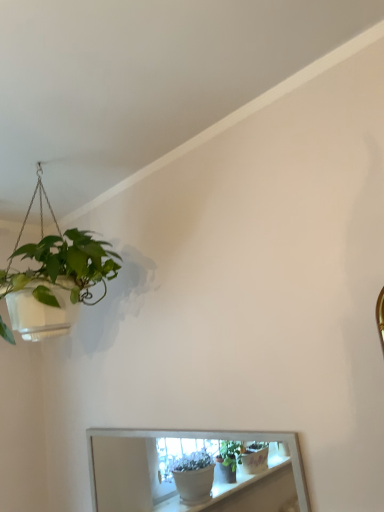
In order to face silver-framed mirror at lower center, should I rotate leftwards or rightwards?

Rotate your view left by about 2.693°.

Where is `silver-framed mirror at lower center`? The image size is (384, 512). silver-framed mirror at lower center is located at coordinates (192, 470).

The width and height of the screenshot is (384, 512). Describe the element at coordinates (192, 470) in the screenshot. I see `silver-framed mirror at lower center` at that location.

Identify the location of silver-framed mirror at lower center. (192, 470).